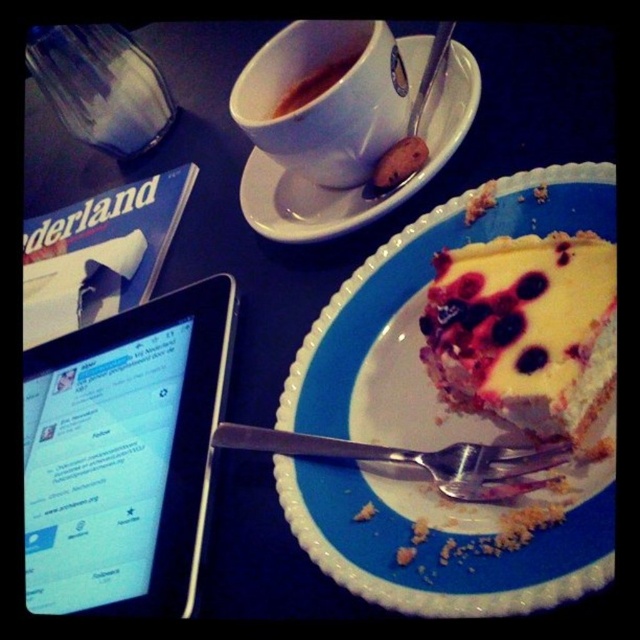
You are a barista preparing a coffee order. You need to place the white ceramic saucer at upper center and the glossy ceramic mug at upper center on a tray. The tray is only 10 centimeters wide. Can you fit both items on the tray without overlapping?

The white ceramic saucer at upper center is 9.76 centimeters away from the glossy ceramic mug at upper center. Since the tray is 10 centimeters wide, there is enough space to fit both items without overlapping as the distance between them is less than the tray width.

You are a waiter in a restaurant and need to place a new order of coffee next to the silver metallic fork at lower center. The coffee cup you have is 25 centimeters in diameter. Can you safely place it there without it touching the existing white ceramic cup at upper center?

The white ceramic cup at upper center is 26.34 centimeters away from the silver metallic fork at lower center. Since the new coffee cup is 25 centimeters in diameter, placing it next to the fork would leave at least 1.34 centimeters of space between the two cups, which is enough to prevent them from touching.